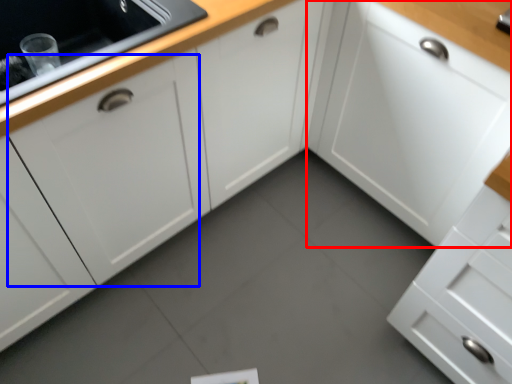
Question: Which point is further to the camera, cabinetry (highlighted by a red box) or cabinetry (highlighted by a blue box)?

Choices:
 (A) cabinetry
 (B) cabinetry

Answer: (A)